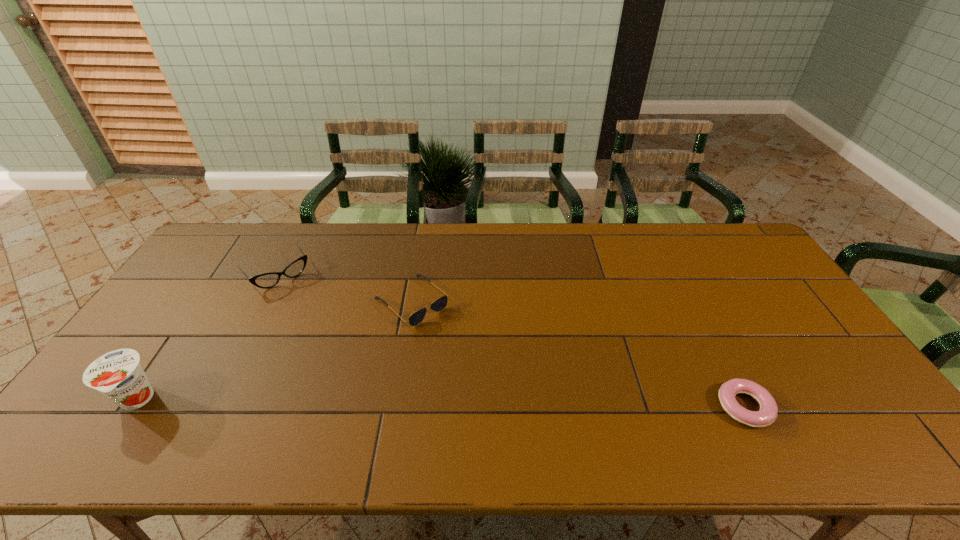
Find the location of a particular element. The image size is (960, 540). blank region between the sunglasses and the third shortest object is located at coordinates (346, 288).

This screenshot has height=540, width=960. Identify the location of empty space between the yogurt and the spectacles. (207, 337).

The image size is (960, 540). Find the location of `vacant area that lies between the sunglasses and the doughnut`. vacant area that lies between the sunglasses and the doughnut is located at coordinates (578, 354).

What are the coordinates of `empty space between the tallest object and the third shortest object` in the screenshot? It's located at (207, 337).

Where is `empty space that is in between the shortest object and the sunglasses`? empty space that is in between the shortest object and the sunglasses is located at coordinates (578, 354).

Locate an element on the screen. The image size is (960, 540). vacant space that is in between the rightmost object and the yogurt is located at coordinates (440, 403).

You are a GUI agent. You are given a task and a screenshot of the screen. Output one action in this format:
    pyautogui.click(x=<x>, y=<y>)
    Task: Click on the vacant space that is in between the third shortest object and the tallest object
    
    Given the screenshot: What is the action you would take?
    pyautogui.click(x=207, y=337)

You are a GUI agent. You are given a task and a screenshot of the screen. Output one action in this format:
    pyautogui.click(x=<x>, y=<y>)
    Task: Click on the vacant area between the rightmost object and the second shortest object
    Image resolution: width=960 pixels, height=540 pixels.
    Given the screenshot: What is the action you would take?
    pyautogui.click(x=578, y=354)

Locate an element on the screen. The width and height of the screenshot is (960, 540). object that is the second closest to the third shortest object is located at coordinates (118, 375).

Find the location of a particular element. Image resolution: width=960 pixels, height=540 pixels. object that is the third nearest to the second object from left to right is located at coordinates click(767, 414).